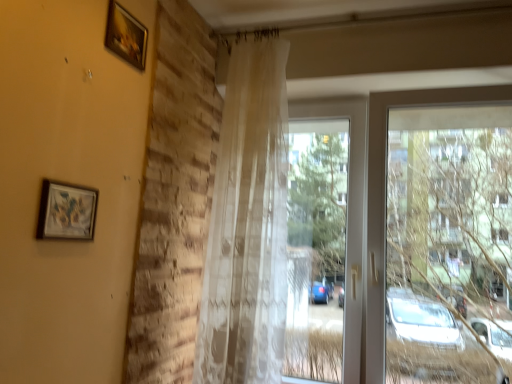
Question: Is point (53, 231) closer or farther from the camera than point (350, 183)?

Choices:
 (A) closer
 (B) farther

Answer: (A)

Question: Is matte wooden picture frame at upper left, which appears as the 2th picture frame when viewed from the top, situated inside transparent fabric curtain at center or outside?

Choices:
 (A) outside
 (B) inside

Answer: (A)

Question: Which object is the farthest from the translucent beige curtain at center?

Choices:
 (A) wooden frame at upper left, the second picture frame ordered from the bottom
 (B) matte wooden picture frame at upper left, arranged as the 2th picture frame when viewed from the back
 (C) transparent fabric curtain at center

Answer: (B)

Question: Estimate the real-world distances between objects in this image. Which object is closer to the transparent fabric curtain at center?

Choices:
 (A) wooden frame at upper left, the 1th picture frame when ordered from right to left
 (B) translucent beige curtain at center
 (C) matte wooden picture frame at upper left, arranged as the 2th picture frame when viewed from the back

Answer: (B)